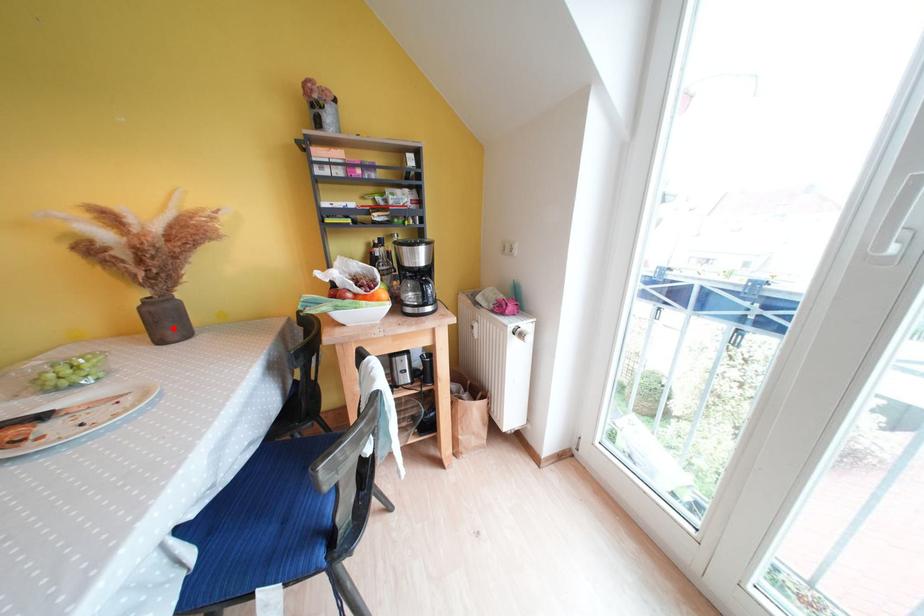
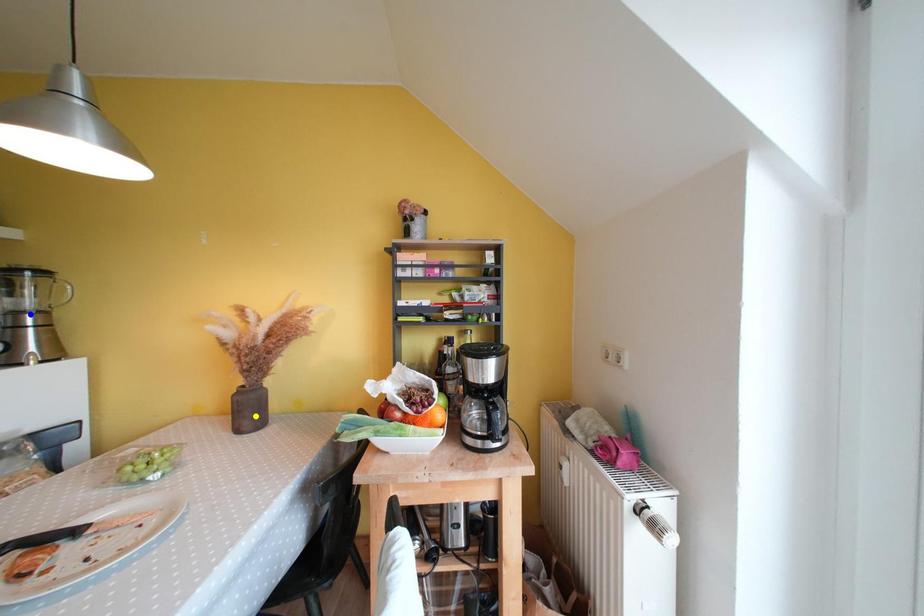
Question: I am providing you with two images of the same scene from different viewpoints. A red point is marked on the first image. You are given multiple points on the second image. Which point in image 2 represents the same 3d spot as the red point in image 1?

Choices:
 (A) green point
 (B) blue point
 (C) yellow point

Answer: (C)